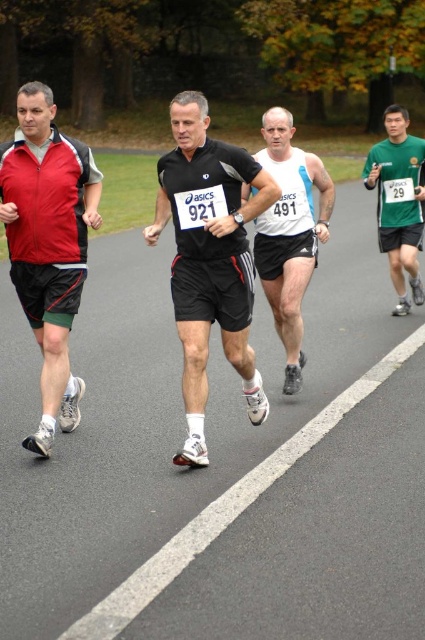
You are a photographer positioned at the starting line of the race. You want to capture a photo of the matte red jacket at left and the white matte running shirt at center. Based on their widths, which runner should you focus on to ensure they fill the frame better?

The matte red jacket at left has a greater width than the white matte running shirt at center, so focusing on the matte red jacket at left would allow it to fill the frame better.

You are a photographer positioned at the starting line of the race. You want to capture a photo that includes both the runner at point [243,221] and the runner at point [48,282]. Which runner should you focus on first to ensure both are in the frame?

You should focus on the runner at point [48,282] first because point [243,221] is in front of it, so adjusting the camera to include both would require starting with the one further back.